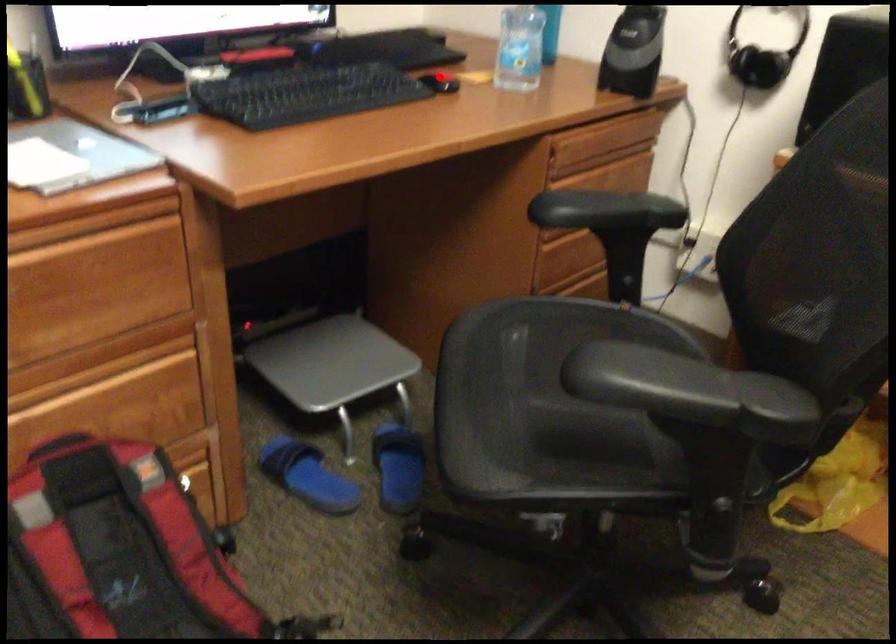
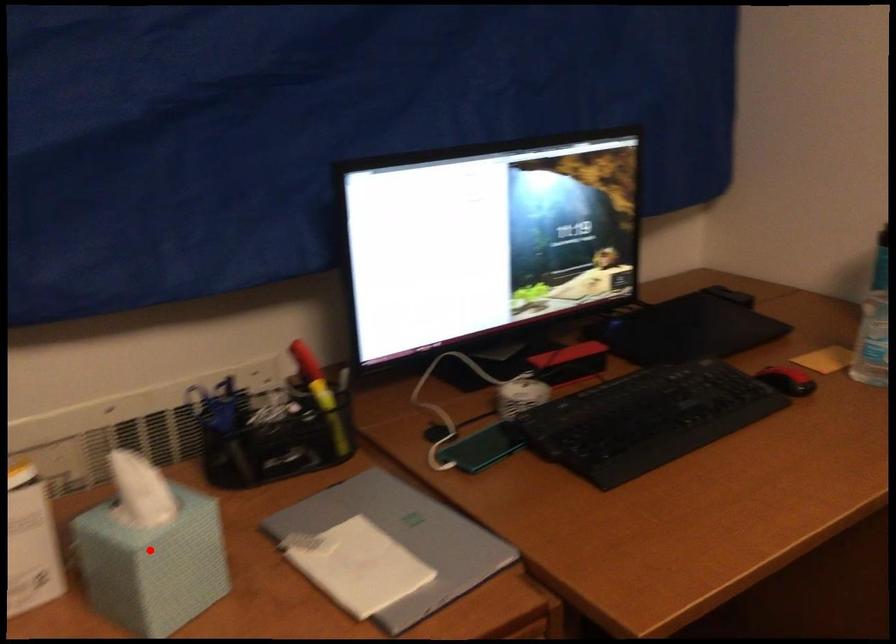
I am providing you with two images of the same scene from different viewpoints. A red point is marked on the first image and another point is marked on the second image. Is the red point in image1 aligned with the point shown in image2?

No